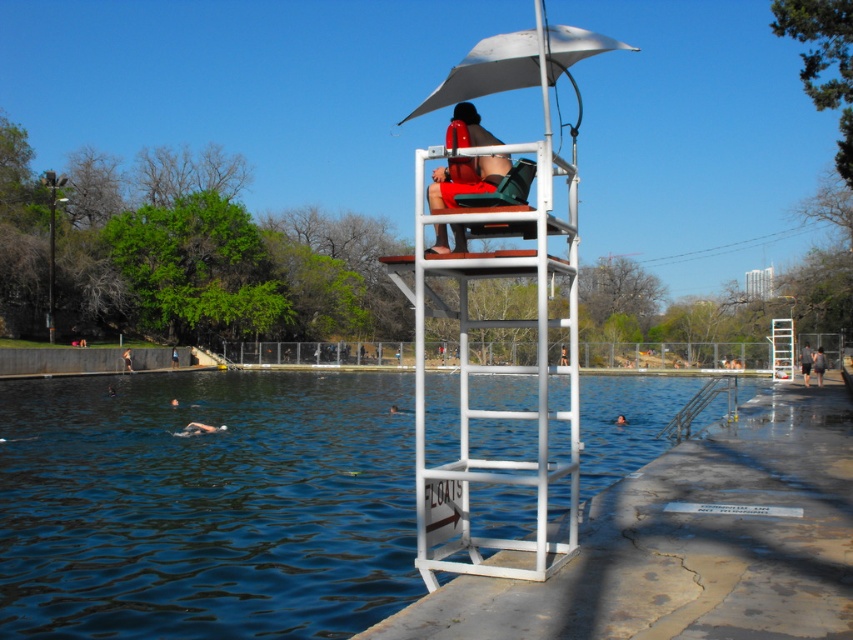
Who is higher up, white metal ladder at center or matte red life vest at center?

white metal ladder at center is above.

What do you see at coordinates (498, 320) in the screenshot? I see `white metal ladder at center` at bounding box center [498, 320].

I want to click on white metal ladder at center, so click(498, 320).

Who is more forward, (775, 364) or (814, 364)?

Point (814, 364) is more forward.

Who is positioned more to the right, white plastic ladder at center or gray fabric shirt at right?

gray fabric shirt at right

Describe the element at coordinates (782, 348) in the screenshot. This screenshot has width=853, height=640. I see `white plastic ladder at center` at that location.

Identify the location of white plastic ladder at center. The width and height of the screenshot is (853, 640). (782, 348).

Looking at this image, can you confirm if black fabric shorts at lower right is positioned to the right of matte black lifeguard chair at center?

Yes, black fabric shorts at lower right is to the right of matte black lifeguard chair at center.

In the scene shown: Between black fabric shorts at lower right and matte black lifeguard chair at center, which one has more height?

With more height is black fabric shorts at lower right.

Is point (804, 358) positioned before point (125, 348)?

Yes, it is in front of point (125, 348).

Locate an element on the screen. This screenshot has height=640, width=853. black fabric shorts at lower right is located at coordinates (805, 362).